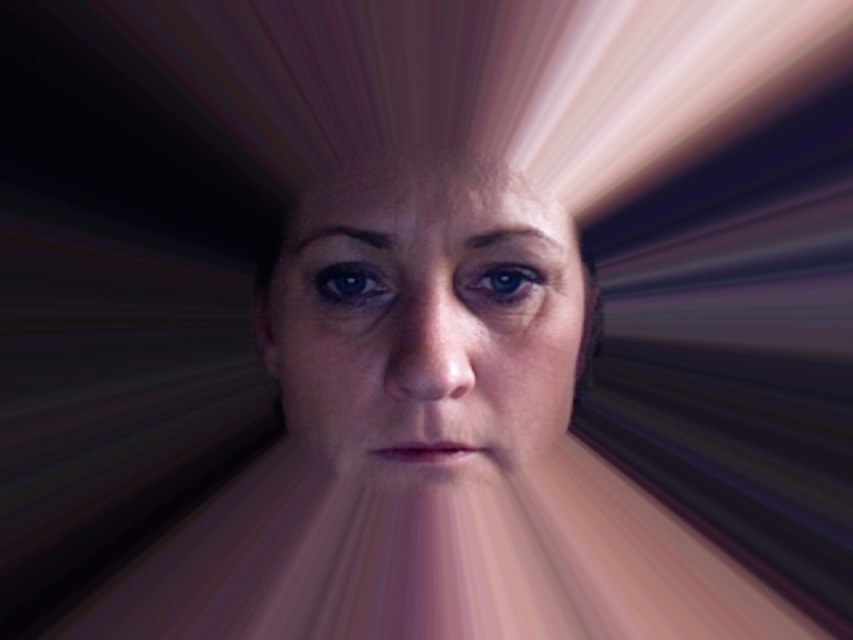
You are an artist analyzing the composition of this image. The scene has a person with a smooth skin face at center and a blue glossy eye at center. Which object takes up more space in the image?

The smooth skin face at center takes up more space in the image because its width is larger than that of the blue glossy eye at center.

You are a photographer using a camera with a focal length of 50mm. You want to take a portrait of the smooth skin face at center while maintaining a sharp focus. Considering the distance between the camera and the subject, what is the minimum focusing distance your camera lens must support?

The smooth skin face at center and camera are 16.21 inches apart. Therefore, the camera lens must support a minimum focusing distance of at least 16.21 inches to capture the portrait sharply.

You are an optometrist examining a patient whose eyes have two distinct layers. The patient has a blue glossy eye at center and a matte blue eye at center. Based on the description, which eye layer is located above the other?

The blue glossy eye at center is positioned over the matte blue eye at center, meaning the glossy layer is above the matte one.